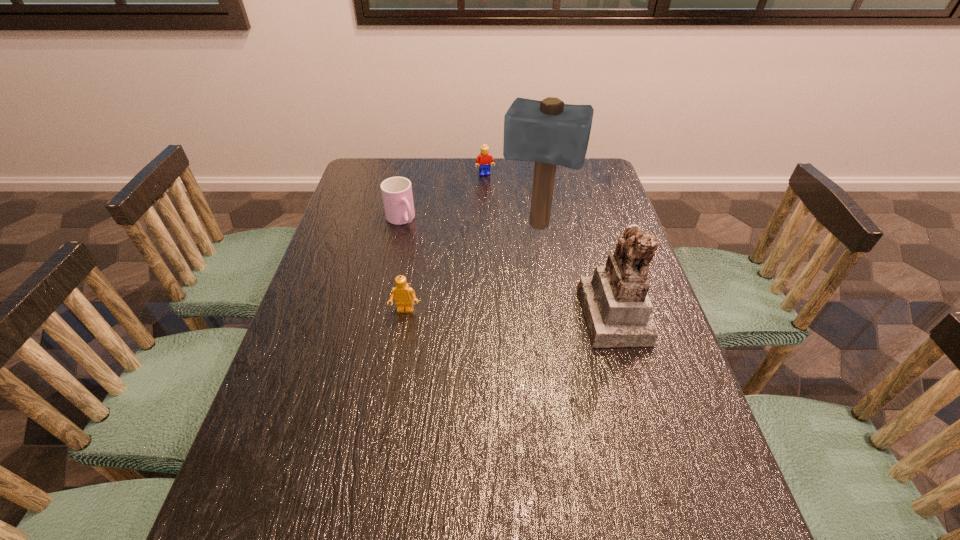
Locate an element on the screen. The width and height of the screenshot is (960, 540). vacant region that satisfies the following two spatial constraints: 1. on the back side of the cup; 2. on the right side of the farther Lego is located at coordinates (411, 174).